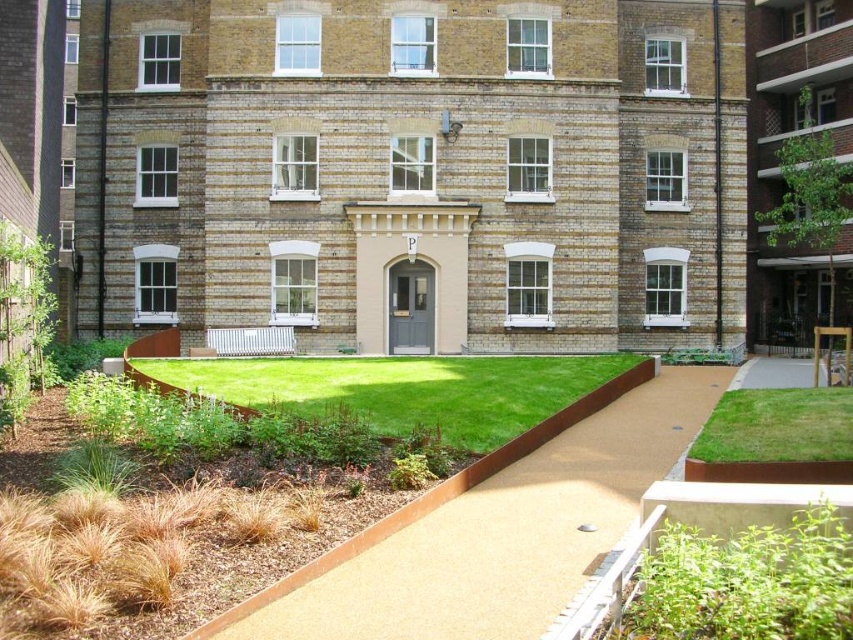
You are a gardener tasked with mowing the lawn in the courtyard. You have two patches of green grass to mow. Which area requires more time to mow, the green grass at center or the green grass at lower right?

The green grass at center requires more time to mow since it is larger in size than the green grass at lower right.

You are standing in the courtyard looking at the entranceway with the gray door. There are two points marked on the entranceway. Which point is closer to you, point (660, 465) or point (737, 451)?

Point (660, 465) is closer to you because it is further to the viewer than point (737, 451).